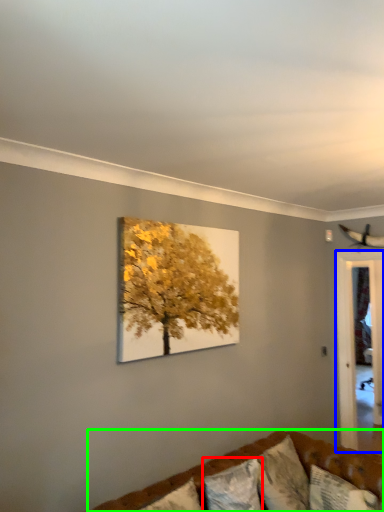
Question: Which is farther away from pillow (highlighted by a red box)? glass door (highlighted by a blue box) or studio couch (highlighted by a green box)?

Choices:
 (A) glass door
 (B) studio couch

Answer: (A)